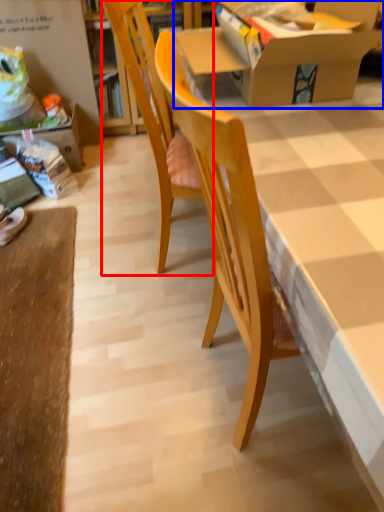
Question: Which object appears farthest to the camera in this image, chair (highlighted by a red box) or box (highlighted by a blue box)?

Choices:
 (A) chair
 (B) box

Answer: (A)